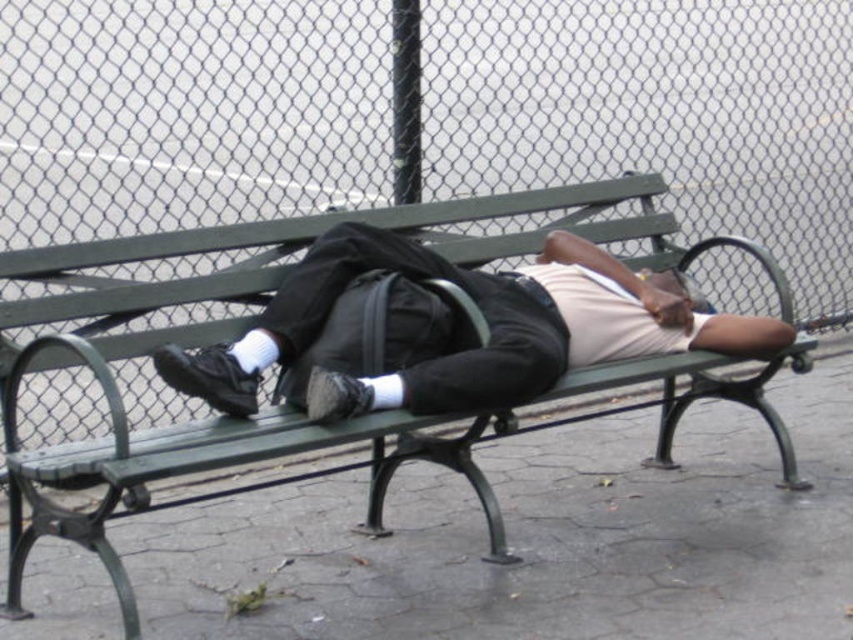
You are a park visitor who wants to place your black matte backpack at center on the green wood park bench at center. Is the backpack currently positioned to the left or right of the bench?

The green wood park bench at center is to the left of the black matte backpack at center, so the backpack is positioned to the right of the bench.

You are a delivery person who needs to deliver a package to the person resting on the green park bench. The package must be placed on the ground near the black matte backpack at center without touching the wire mesh fence at upper center. Is this possible?

The wire mesh fence at upper center is above the black matte backpack at center, so yes, the package can be placed on the ground near the black matte backpack at center without touching the fence since it is positioned above.

You are a delivery drone that needs to fly from the road behind the wire mesh fence at upper center to deliver a package to the green wood park bench at center. Can you fit through the fence without damaging it?

The wire mesh fence at upper center has a larger size compared to green wood park bench at center, but the description does not provide specific measurements about the fence openings. Therefore, it is uncertain if the drone can fit through the fence without damaging it.